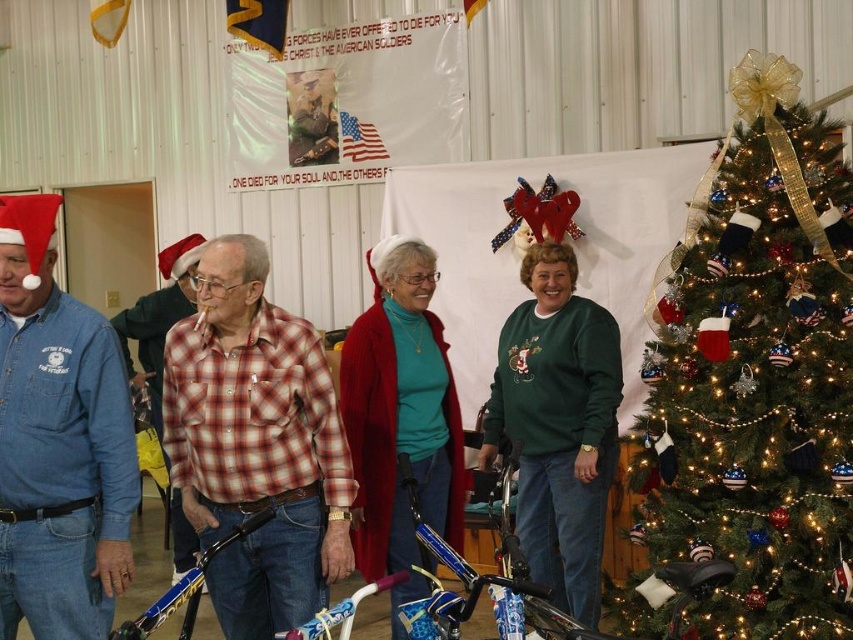
Based on the photo, between green textured christmas tree at right and denim shirt at left, which one is positioned lower?

Positioned lower is denim shirt at left.

Is green textured christmas tree at right positioned before denim shirt at left?

No, it is not.

Who is more forward, (851, 259) or (55, 563)?

Point (55, 563) is more forward.

Locate an element on the screen. green textured christmas tree at right is located at coordinates (753, 381).

Looking at this image, does denim shirt at left appear under green fleece sweater at center?

Actually, denim shirt at left is above green fleece sweater at center.

In the scene shown: Can you confirm if denim shirt at left is smaller than green fleece sweater at center?

Correct, denim shirt at left occupies less space than green fleece sweater at center.

You are a GUI agent. You are given a task and a screenshot of the screen. Output one action in this format:
    pyautogui.click(x=<x>, y=<y>)
    Task: Click on the denim shirt at left
    The height and width of the screenshot is (640, 853).
    Given the screenshot: What is the action you would take?
    pyautogui.click(x=57, y=442)

Where is `denim shirt at left`? denim shirt at left is located at coordinates (57, 442).

Does plaid shirt at center have a lesser height compared to denim shirt at left?

Yes, plaid shirt at center is shorter than denim shirt at left.

At what (x,y) coordinates should I click in order to perform the action: click on plaid shirt at center. Please return your answer as a coordinate pair (x, y). This screenshot has height=640, width=853. Looking at the image, I should click on (256, 444).

Identify the location of plaid shirt at center. This screenshot has height=640, width=853. (256, 444).